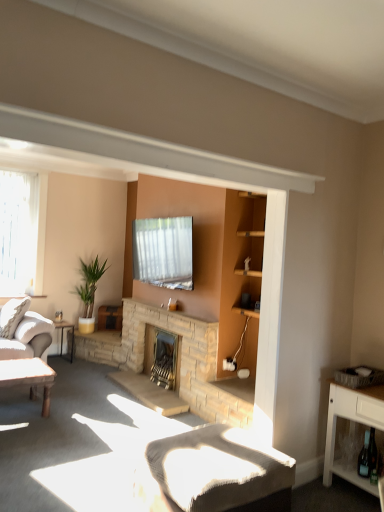
Question: From a real-world perspective, relative to metallic silver table at left, arranged as the second table when viewed from the front, is white wood cabinet at lower right vertically above or below?

Choices:
 (A) below
 (B) above

Answer: (B)

Question: From the image's perspective, is white wood cabinet at lower right positioned above or below metallic silver table at left, arranged as the second table when viewed from the front?

Choices:
 (A) above
 (B) below

Answer: (B)

Question: Which object is the farthest from the green glass wine bottle at lower right?

Choices:
 (A) metallic silver table at left, marked as the 1th table in a back-to-front arrangement
 (B) natural stone fireplace at center, which is counted as the second fireplace, starting from the back
 (C) white textured cushion at lower center
 (D) wooden table at lower left, which appears as the 2th table when viewed from the back
 (E) clear glass window at left

Answer: (E)

Question: Considering the real-world distances, which object is closest to the white textured cushion at lower center?

Choices:
 (A) green leafy plant in pot at left
 (B) stone fireplace at center, which is the first fireplace in back-to-front order
 (C) natural stone fireplace at center, the 1th fireplace viewed from the front
 (D) metallic silver table at left, marked as the 1th table in a back-to-front arrangement
 (E) wooden table at lower left, the first table when ordered from front to back

Answer: (C)